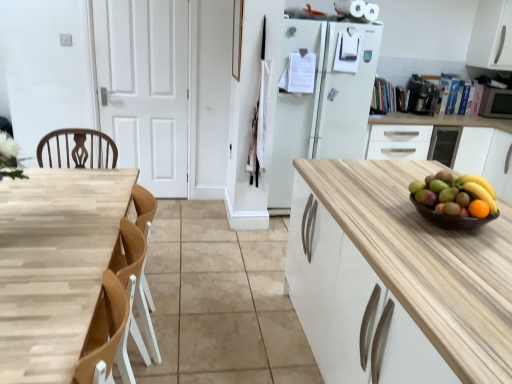
Question: Is white matte cabinet at right, the 2th cabinetry in the top-to-bottom sequence, taller than white matte door at center?

Choices:
 (A) no
 (B) yes

Answer: (A)

Question: Is white matte cabinet at right, acting as the first cabinetry starting from the bottom, directly adjacent to white matte door at center?

Choices:
 (A) yes
 (B) no

Answer: (B)

Question: Is white matte cabinet at right, the 2th cabinetry in the top-to-bottom sequence, positioned in front of white matte door at center?

Choices:
 (A) no
 (B) yes

Answer: (A)

Question: From the image's perspective, is white matte cabinet at right, acting as the first cabinetry starting from the bottom, beneath white matte door at center?

Choices:
 (A) yes
 (B) no

Answer: (A)

Question: Is white matte cabinet at right, the 2th cabinetry in the top-to-bottom sequence, thinner than white matte door at center?

Choices:
 (A) no
 (B) yes

Answer: (A)

Question: Considering the relative positions of white matte cabinet at right, the 2th cabinetry in the top-to-bottom sequence, and white matte door at center in the image provided, is white matte cabinet at right, the 2th cabinetry in the top-to-bottom sequence, to the right of white matte door at center from the viewer's perspective?

Choices:
 (A) yes
 (B) no

Answer: (A)

Question: Is black plastic coffee maker at upper right, the first appliance in the left-to-right sequence, taller than matte brown bowl at right?

Choices:
 (A) no
 (B) yes

Answer: (B)

Question: Is black plastic coffee maker at upper right, marked as the 2th appliance in a right-to-left arrangement, positioned beyond the bounds of matte brown bowl at right?

Choices:
 (A) yes
 (B) no

Answer: (A)

Question: Considering the relative positions of black plastic coffee maker at upper right, marked as the 2th appliance in a right-to-left arrangement, and matte brown bowl at right in the image provided, is black plastic coffee maker at upper right, marked as the 2th appliance in a right-to-left arrangement, to the left of matte brown bowl at right from the viewer's perspective?

Choices:
 (A) yes
 (B) no

Answer: (B)

Question: Considering the relative sizes of black plastic coffee maker at upper right, the first appliance in the left-to-right sequence, and matte brown bowl at right in the image provided, is black plastic coffee maker at upper right, the first appliance in the left-to-right sequence, bigger than matte brown bowl at right?

Choices:
 (A) no
 (B) yes

Answer: (B)

Question: Considering the relative sizes of black plastic coffee maker at upper right, the first appliance in the left-to-right sequence, and matte brown bowl at right in the image provided, is black plastic coffee maker at upper right, the first appliance in the left-to-right sequence, thinner than matte brown bowl at right?

Choices:
 (A) no
 (B) yes

Answer: (A)

Question: Is black plastic coffee maker at upper right, the first appliance in the left-to-right sequence, placed right next to matte brown bowl at right?

Choices:
 (A) no
 (B) yes

Answer: (A)

Question: From a real-world perspective, is white matte cabinet at upper right, the second cabinetry from the bottom, under white matte door at center?

Choices:
 (A) no
 (B) yes

Answer: (A)